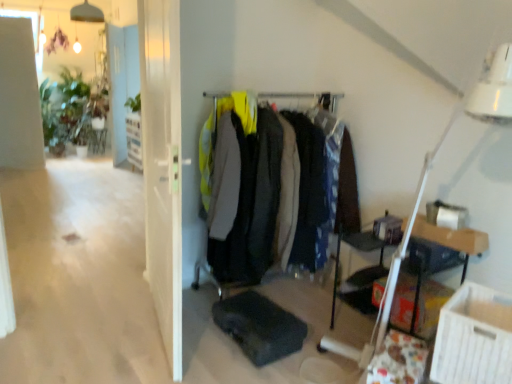
Question: Is there a large distance between white plastic table lamp at upper right and wooden table at right?

Choices:
 (A) no
 (B) yes

Answer: (A)

Question: Is white plastic table lamp at upper right smaller than wooden table at right?

Choices:
 (A) yes
 (B) no

Answer: (B)

Question: Does white plastic table lamp at upper right appear on the right side of wooden table at right?

Choices:
 (A) no
 (B) yes

Answer: (A)

Question: Is white plastic table lamp at upper right taller than wooden table at right?

Choices:
 (A) no
 (B) yes

Answer: (B)

Question: Is white plastic table lamp at upper right thinner than wooden table at right?

Choices:
 (A) no
 (B) yes

Answer: (A)

Question: Can you confirm if white plastic table lamp at upper right is shorter than wooden table at right?

Choices:
 (A) yes
 (B) no

Answer: (B)

Question: Does green matte plant at upper left have a greater height compared to white cardboard box at lower right?

Choices:
 (A) yes
 (B) no

Answer: (A)

Question: From the image's perspective, does green matte plant at upper left appear higher than white cardboard box at lower right?

Choices:
 (A) no
 (B) yes

Answer: (B)

Question: Is white cardboard box at lower right surrounded by green matte plant at upper left?

Choices:
 (A) no
 (B) yes

Answer: (A)

Question: Can we say green matte plant at upper left lies outside white cardboard box at lower right?

Choices:
 (A) no
 (B) yes

Answer: (B)

Question: Does green matte plant at upper left have a larger size compared to white cardboard box at lower right?

Choices:
 (A) yes
 (B) no

Answer: (B)

Question: From a real-world perspective, is green matte plant at upper left positioned over white cardboard box at lower right based on gravity?

Choices:
 (A) no
 (B) yes

Answer: (B)

Question: Is matte black coat rack at center not near white glossy door at upper center?

Choices:
 (A) no
 (B) yes

Answer: (B)